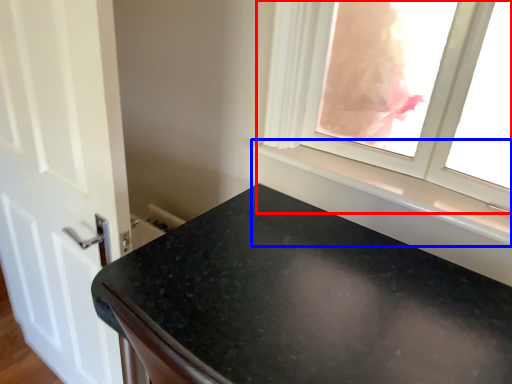
Question: Which of the following is the closest to the observer, window (highlighted by a red box) or window sill (highlighted by a blue box)?

Choices:
 (A) window
 (B) window sill

Answer: (A)